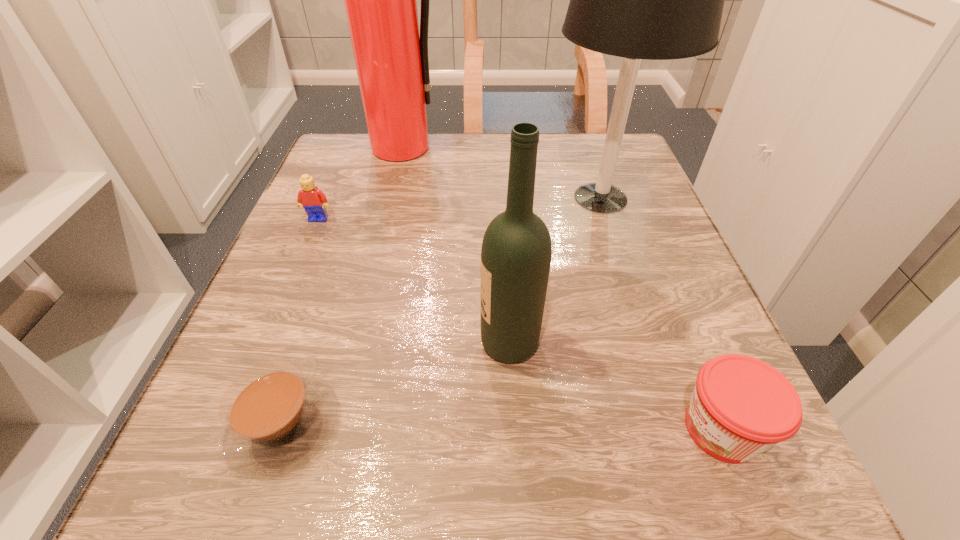
Image resolution: width=960 pixels, height=540 pixels. What are the coordinates of `cappuccino that is at the near edge` in the screenshot? It's located at (275, 419).

The height and width of the screenshot is (540, 960). Identify the location of fire extinguisher positioned at the left edge. (391, 58).

Where is `Lego at the left edge`? The width and height of the screenshot is (960, 540). Lego at the left edge is located at coordinates (313, 200).

Locate an element on the screen. This screenshot has width=960, height=540. cappuccino that is positioned at the left edge is located at coordinates (275, 419).

At what (x,y) coordinates should I click in order to perform the action: click on table lamp at the right edge. Please return your answer as a coordinate pair (x, y). Looking at the image, I should click on (657, 0).

You are a GUI agent. You are given a task and a screenshot of the screen. Output one action in this format:
    pyautogui.click(x=<x>, y=<y>)
    Task: Click on the jam that is at the right edge
    The image size is (960, 540).
    Given the screenshot: What is the action you would take?
    pyautogui.click(x=741, y=406)

Identify the location of object that is at the far left corner. The width and height of the screenshot is (960, 540). (391, 58).

At what (x,y) coordinates should I click in order to perform the action: click on object that is positioned at the near left corner. Please return your answer as a coordinate pair (x, y). The image size is (960, 540). Looking at the image, I should click on (275, 419).

Identify the location of object present at the far right corner. (657, 0).

At what (x,y) coordinates should I click in order to perform the action: click on object present at the near right corner. Please return your answer as a coordinate pair (x, y). Looking at the image, I should click on (741, 406).